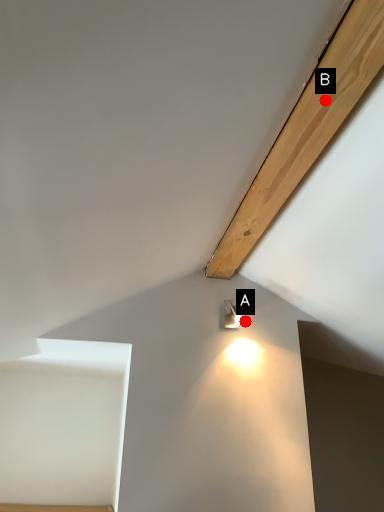
Question: Two points are circled on the image, labeled by A and B beside each circle. Among these points, which one is nearest to the camera?

Choices:
 (A) A is closer
 (B) B is closer

Answer: (B)